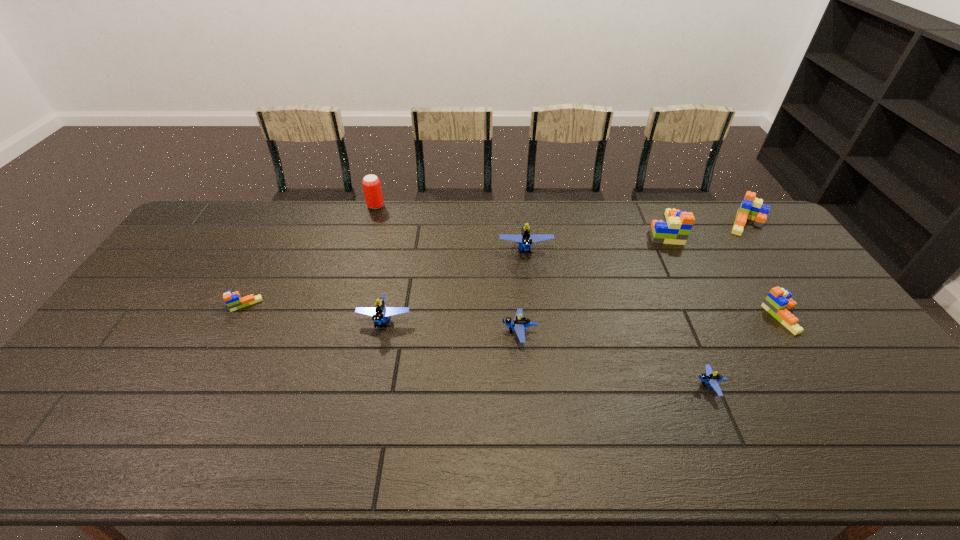
Identify the location of free space that satisfies the following two spatial constraints: 1. on the front side of the second biggest orange Lego; 2. on the front-facing side of the third biggest blue Lego. (824, 333).

The image size is (960, 540). What are the coordinates of `free location that satisfies the following two spatial constraints: 1. on the front side of the third smallest orange Lego; 2. on the front-facing side of the nearest Lego` in the screenshot? It's located at (862, 386).

The width and height of the screenshot is (960, 540). Find the location of `vacant region that satisfies the following two spatial constraints: 1. on the back side of the third orange Lego from right to left; 2. on the left side of the second biggest orange Lego`. vacant region that satisfies the following two spatial constraints: 1. on the back side of the third orange Lego from right to left; 2. on the left side of the second biggest orange Lego is located at coordinates (661, 224).